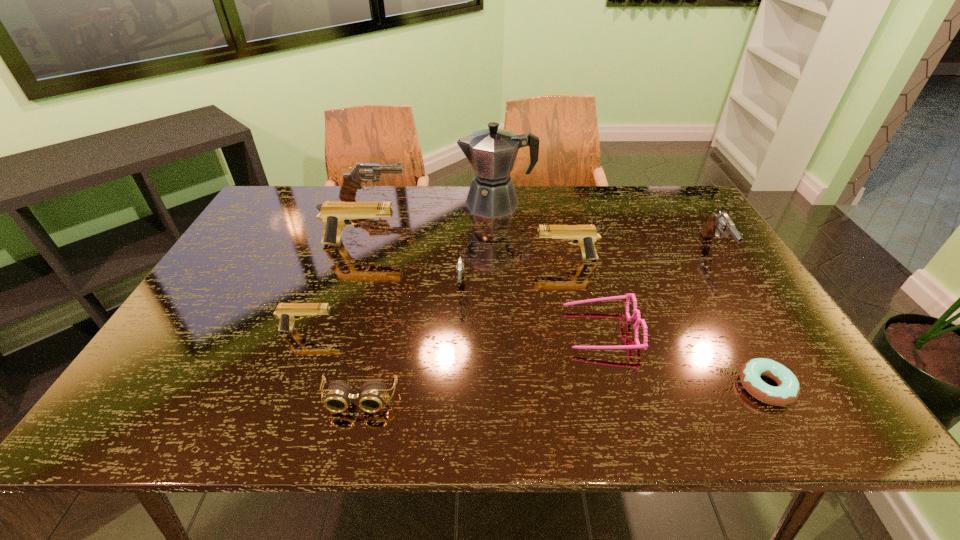
Locate an element on the screen. This screenshot has width=960, height=540. free space that satisfies the following two spatial constraints: 1. at the barrel of the rightmost gray pistol; 2. at the barrel of the nearest pistol is located at coordinates pyautogui.click(x=768, y=330).

Where is `free space that satisfies the following two spatial constraints: 1. on the back side of the second object from right to left; 2. at the barrel of the biggest gray pistol`? This screenshot has height=540, width=960. free space that satisfies the following two spatial constraints: 1. on the back side of the second object from right to left; 2. at the barrel of the biggest gray pistol is located at coordinates (659, 201).

The height and width of the screenshot is (540, 960). Identify the location of vacant space that satisfies the following two spatial constraints: 1. at the barrel of the second nearest tan pistol; 2. at the barrel of the nearest gray pistol. (573, 287).

I want to click on vacant point that satisfies the following two spatial constraints: 1. at the spout of the coffeepot; 2. on the left side of the second object from right to left, so click(x=506, y=387).